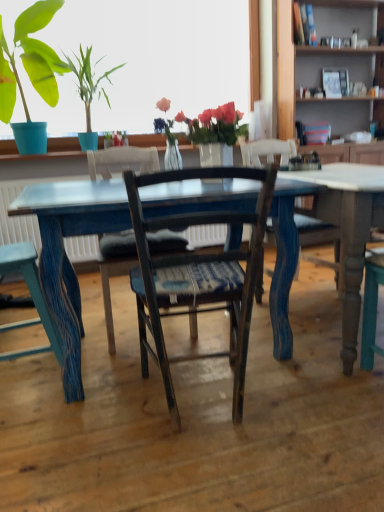
Question: Considering their positions, is translucent glass vase at upper center located in front of or behind blue painted wood table at center?

Choices:
 (A) front
 (B) behind

Answer: (B)

Question: Does point (170, 137) appear closer or farther from the camera than point (322, 167)?

Choices:
 (A) closer
 (B) farther

Answer: (A)

Question: Considering the real-world distances, which object is farthest from the wooden chair with woven seat cushion at center, arranged as the third chair when viewed from the left?

Choices:
 (A) wooden bookshelf at upper right
 (B) translucent glass vase at upper center
 (C) blue painted wood table at center
 (D) matte blue pot at upper left
 (E) wooden chair at center, positioned as the 2th chair in left-to-right order

Answer: (A)

Question: Which object is the closest to the wooden chair at center, positioned as the 2th chair in left-to-right order?

Choices:
 (A) blue painted wood table at center
 (B) wooden bookshelf at upper right
 (C) wooden chair with woven seat cushion at center, positioned as the 1th chair in right-to-left order
 (D) translucent glass vase at upper center
 (E) matte blue pot at upper left

Answer: (D)